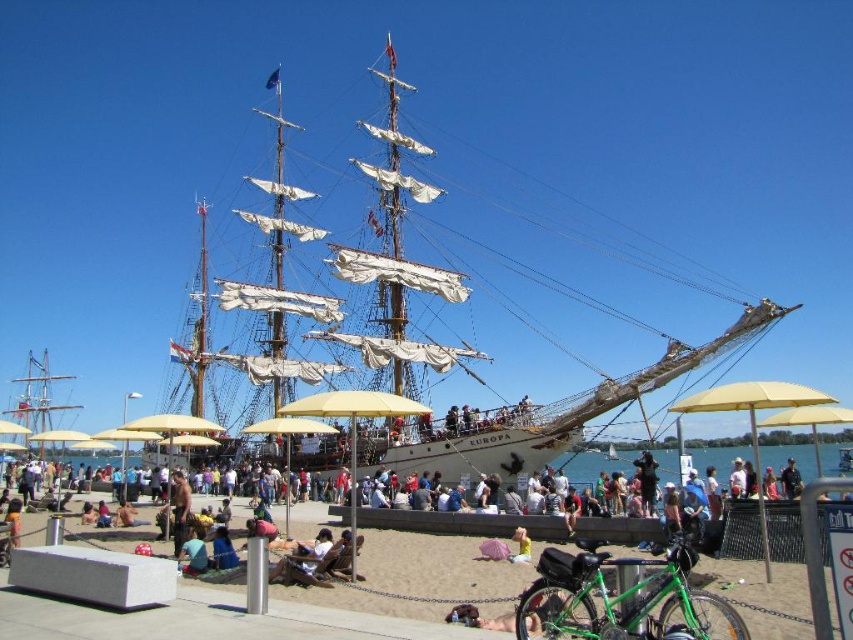
Is wooden ship at center below yellow fabric umbrella at lower right?

No.

Is point (280, 156) in front of point (773, 419)?

No, (280, 156) is behind (773, 419).

The image size is (853, 640). In order to click on wooden ship at center in this screenshot , I will do click(659, 371).

Locate an element on the screen. The width and height of the screenshot is (853, 640). wooden ship at center is located at coordinates (659, 371).

Can you confirm if wooden ship at center is positioned to the left of yellow fabric umbrella at center?

Indeed, wooden ship at center is positioned on the left side of yellow fabric umbrella at center.

Between wooden ship at center and yellow fabric umbrella at center, which one has more height?

wooden ship at center is taller.

Is point (379, 232) farther from viewer compared to point (703, 396)?

Yes, it is behind point (703, 396).

The width and height of the screenshot is (853, 640). Identify the location of wooden ship at center. (659, 371).

Which of these two, yellow fabric umbrella at center or yellow fabric umbrella at lower right, stands taller?

yellow fabric umbrella at center

Is yellow fabric umbrella at center in front of yellow fabric umbrella at lower right?

Yes, it is.

The width and height of the screenshot is (853, 640). What do you see at coordinates (753, 419) in the screenshot? I see `yellow fabric umbrella at center` at bounding box center [753, 419].

Locate an element on the screen. This screenshot has height=640, width=853. yellow fabric umbrella at center is located at coordinates (753, 419).